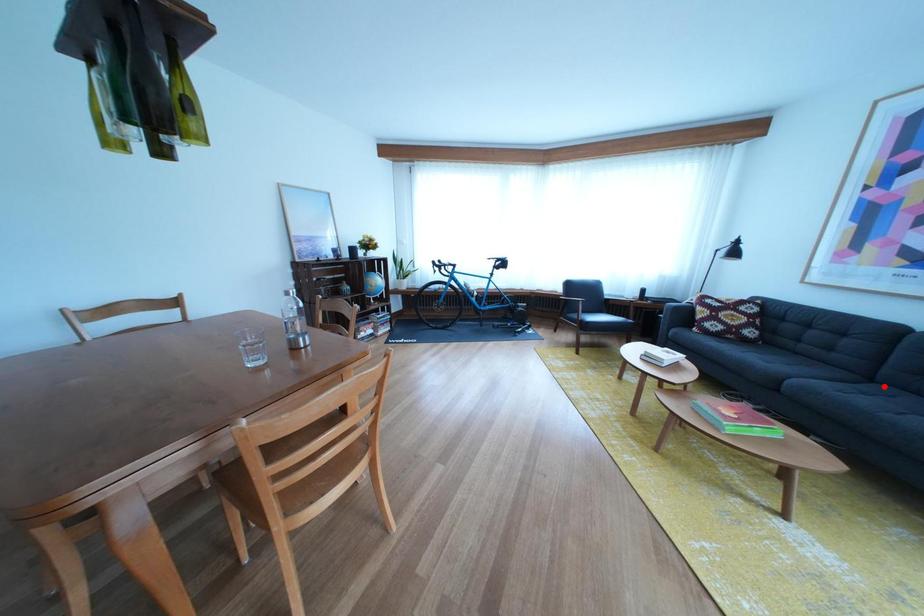
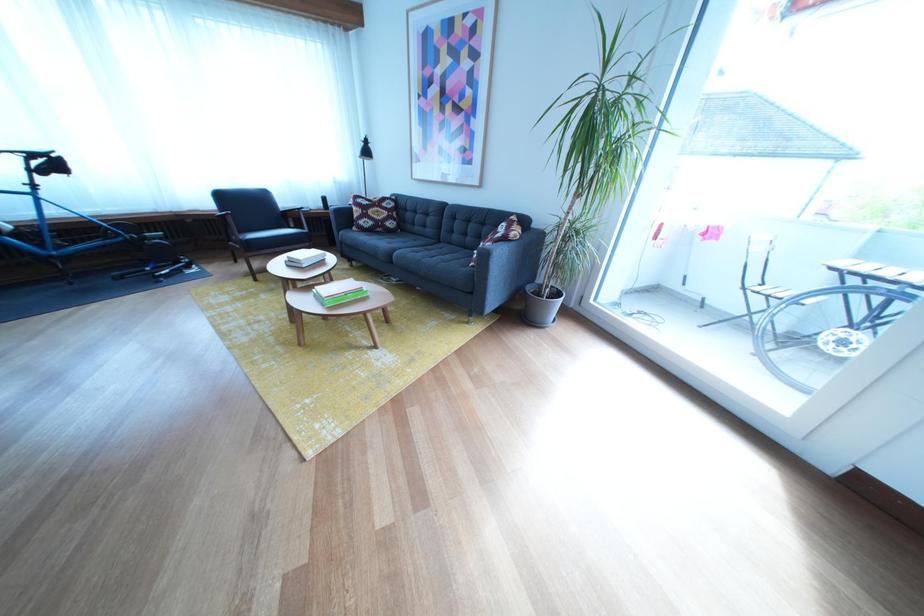
Question: A red point is marked in image1. In image2, is the corresponding 3D point closer to the camera or farther? Reply with the corresponding letter.

Choices:
 (A) The corresponding 3D point is closer.
 (B) The corresponding 3D point is farther.

Answer: (A)